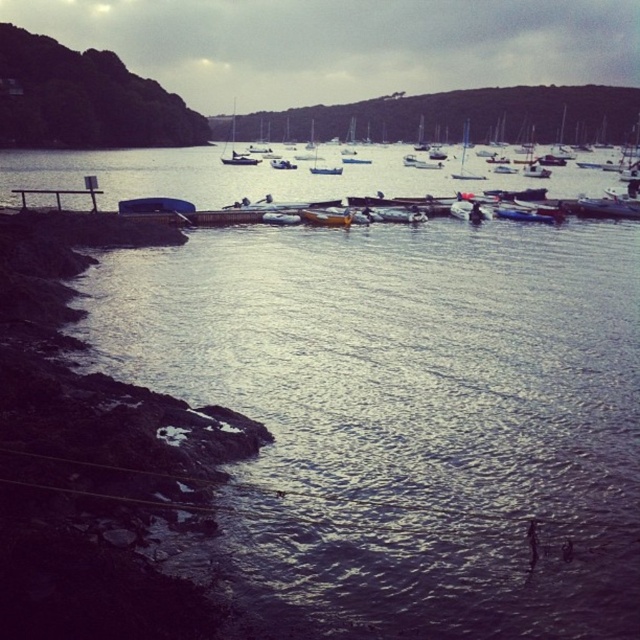
Between point (348, 225) and point (221, 160), which one is positioned in front?

Point (348, 225)

Find the location of `yellow plastic boat at center`. yellow plastic boat at center is located at coordinates (324, 218).

Does wooden dock at left have a lesser height compared to white plastic sailboat at center?

Yes.

Looking at this image, can you confirm if wooden dock at left is positioned to the left of white plastic sailboat at center?

Indeed, wooden dock at left is positioned on the left side of white plastic sailboat at center.

I want to click on wooden dock at left, so click(58, 195).

Identify the location of wooden dock at left. (58, 195).

From the picture: Is yellow plastic boat at center to the left of white plastic sailboat at center from the viewer's perspective?

Yes, yellow plastic boat at center is to the left of white plastic sailboat at center.

Which is in front, point (337, 221) or point (464, 161)?

Point (337, 221) is in front.

Is point (330, 216) closer to camera compared to point (464, 145)?

Yes, point (330, 216) is closer to viewer.

Where is `yellow plastic boat at center`? yellow plastic boat at center is located at coordinates (324, 218).